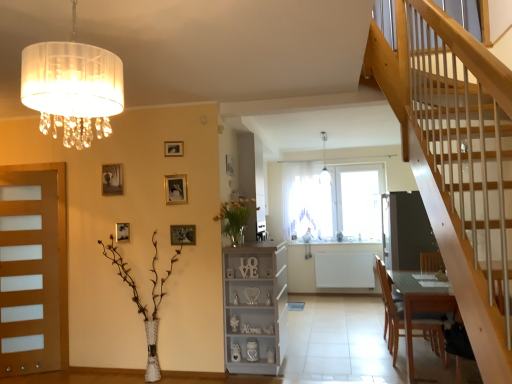
Question: Is wooden picture frame at upper center, placed as the fourth picture frame when sorted from right to left, far from matte gold picture frame at upper left, the sixth picture frame viewed from the right?

Choices:
 (A) yes
 (B) no

Answer: (B)

Question: From a real-world perspective, is wooden picture frame at upper center, arranged as the fourth picture frame when viewed from the back, beneath matte gold picture frame at upper left, the second picture frame positioned from the back?

Choices:
 (A) yes
 (B) no

Answer: (B)

Question: Does wooden picture frame at upper center, arranged as the fourth picture frame when viewed from the back, turn towards matte gold picture frame at upper left, arranged as the 5th picture frame when viewed from the front?

Choices:
 (A) no
 (B) yes

Answer: (A)

Question: Does wooden picture frame at upper center, which is the 3th picture frame from front to back, have a lesser width compared to matte gold picture frame at upper left, arranged as the 5th picture frame when viewed from the front?

Choices:
 (A) yes
 (B) no

Answer: (A)

Question: Considering the relative sizes of wooden picture frame at upper center, which is the 3th picture frame from front to back, and matte gold picture frame at upper left, the sixth picture frame viewed from the right, in the image provided, is wooden picture frame at upper center, which is the 3th picture frame from front to back, wider than matte gold picture frame at upper left, the sixth picture frame viewed from the right,?

Choices:
 (A) yes
 (B) no

Answer: (B)

Question: From the image's perspective, is wooden picture frame at upper left, which is the 4th picture frame in front-to-back order, located above or below dark gray matte screen door at center?

Choices:
 (A) below
 (B) above

Answer: (B)

Question: Is wooden picture frame at upper left, arranged as the second picture frame when viewed from the left, spatially inside dark gray matte screen door at center, or outside of it?

Choices:
 (A) outside
 (B) inside

Answer: (A)

Question: Considering the positions of wooden picture frame at upper left, which is the 4th picture frame in front-to-back order, and dark gray matte screen door at center in the image, is wooden picture frame at upper left, which is the 4th picture frame in front-to-back order, bigger or smaller than dark gray matte screen door at center?

Choices:
 (A) small
 (B) big

Answer: (A)

Question: Considering the positions of wooden picture frame at upper left, which is the third picture frame from back to front, and dark gray matte screen door at center in the image, is wooden picture frame at upper left, which is the third picture frame from back to front, wider or thinner than dark gray matte screen door at center?

Choices:
 (A) wide
 (B) thin

Answer: (B)

Question: Is yellow matte vase at center, which is the 2th floral arrangement from left to right, taller or shorter than matte gold picture frame at upper left, the second picture frame positioned from the back?

Choices:
 (A) tall
 (B) short

Answer: (A)

Question: From the image's perspective, relative to matte gold picture frame at upper left, the first picture frame in the left-to-right sequence, is yellow matte vase at center, positioned as the first floral arrangement in top-to-bottom order, above or below?

Choices:
 (A) below
 (B) above

Answer: (A)

Question: Do you think yellow matte vase at center, positioned as the first floral arrangement in top-to-bottom order, is within matte gold picture frame at upper left, the second picture frame positioned from the back, or outside of it?

Choices:
 (A) outside
 (B) inside

Answer: (A)

Question: From a real-world perspective, is yellow matte vase at center, which is counted as the second floral arrangement, starting from the bottom, physically located above or below matte gold picture frame at upper left, the second picture frame positioned from the back?

Choices:
 (A) above
 (B) below

Answer: (B)

Question: Is white glass pendant light at upper center in front of or behind wooden picture frame at upper center, the 6th picture frame positioned from the left, in the image?

Choices:
 (A) front
 (B) behind

Answer: (B)

Question: Is white glass pendant light at upper center to the left or to the right of wooden picture frame at upper center, the 1th picture frame positioned from the right, in the image?

Choices:
 (A) right
 (B) left

Answer: (A)